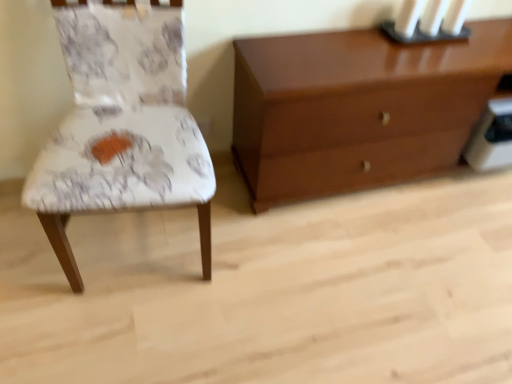
This screenshot has width=512, height=384. What are the coordinates of `free location in front of white fabric chair at left` in the screenshot? It's located at (119, 337).